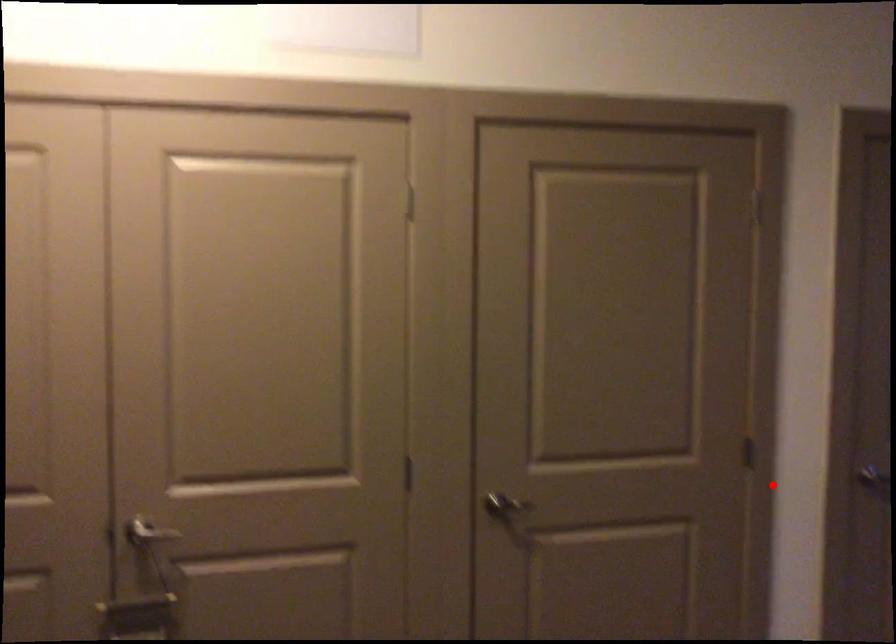
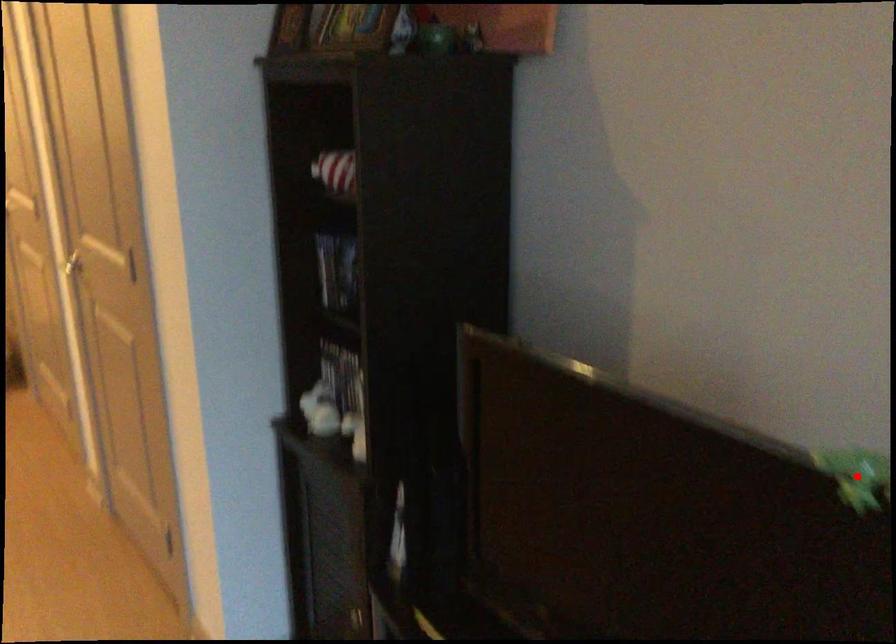
I am providing you with two images of the same scene from different viewpoints. A red point is marked on the first image and another point is marked on the second image. Do the highlighted points in image1 and image2 indicate the same real-world spot?

No